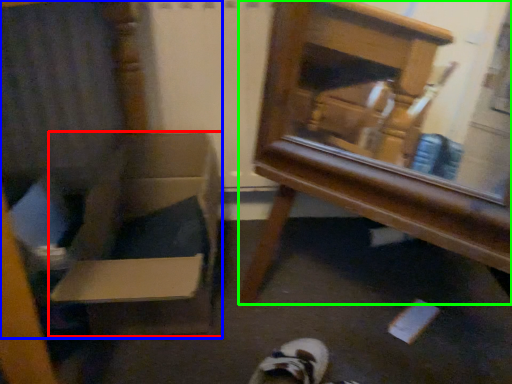
Question: Estimate the real-world distances between objects in this image. Which object is farther from cardboard box (highlighted by a red box), armchair (highlighted by a blue box) or furniture (highlighted by a green box)?

Choices:
 (A) armchair
 (B) furniture

Answer: (B)